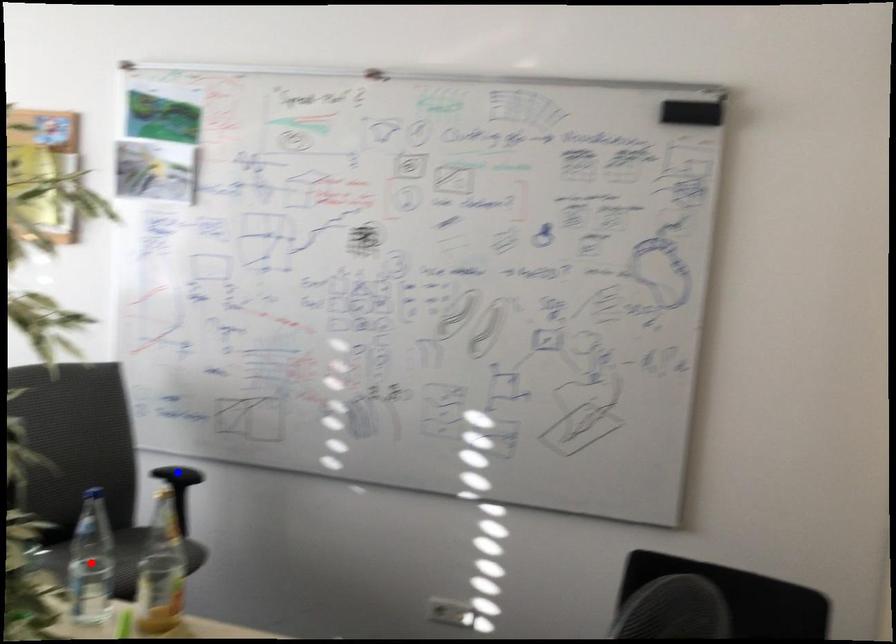
Question: In the image, two points are highlighted. Which point is nearer to the camera? Reply with the corresponding letter.

Choices:
 (A) blue point
 (B) red point

Answer: (B)